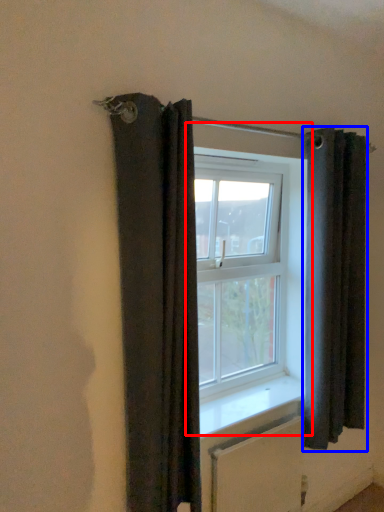
Question: Which of the following is the closest to the observer, window (highlighted by a red box) or curtain (highlighted by a blue box)?

Choices:
 (A) window
 (B) curtain

Answer: (B)